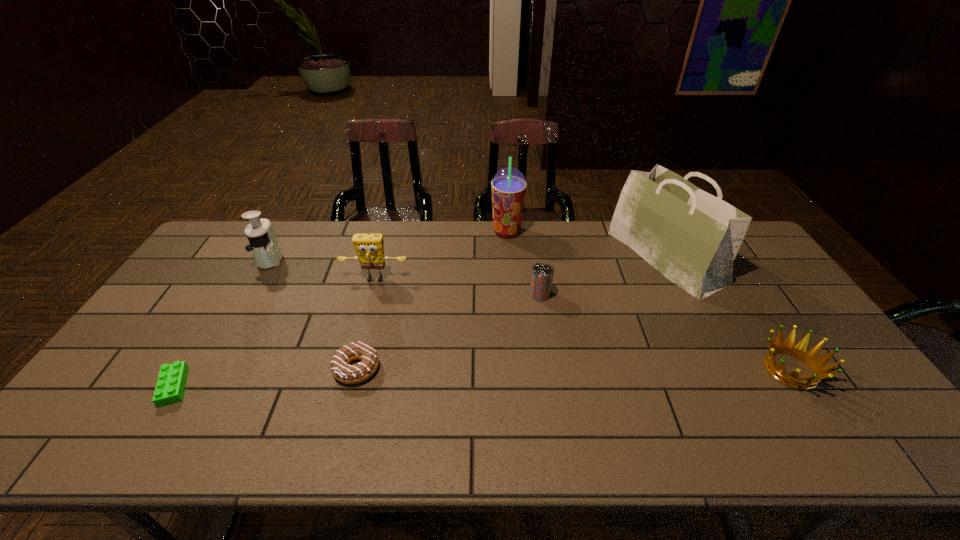
The width and height of the screenshot is (960, 540). What are the coordinates of `grocery bag located at the right edge` in the screenshot? It's located at (691, 237).

At what (x,y) coordinates should I click in order to perform the action: click on crown that is positioned at the right edge. Please return your answer as a coordinate pair (x, y). Looking at the image, I should click on (817, 365).

This screenshot has height=540, width=960. I want to click on object at the far right corner, so pyautogui.click(x=691, y=237).

In order to click on free space at the far edge of the desktop in this screenshot , I will do `click(422, 225)`.

Where is `free spot at the near edge of the desktop`? free spot at the near edge of the desktop is located at coordinates (778, 425).

In the image, there is a desktop. Find the location of `vacant space at the left edge`. vacant space at the left edge is located at coordinates (136, 345).

Locate an element on the screen. The image size is (960, 540). vacant space at the right edge of the desktop is located at coordinates (764, 317).

The height and width of the screenshot is (540, 960). In order to click on vacant space at the near right corner in this screenshot , I will do `click(901, 438)`.

The width and height of the screenshot is (960, 540). I want to click on free space between the beer can and the Lego, so click(x=357, y=341).

Find the location of `unoccupied position between the beer can and the crown`. unoccupied position between the beer can and the crown is located at coordinates (665, 332).